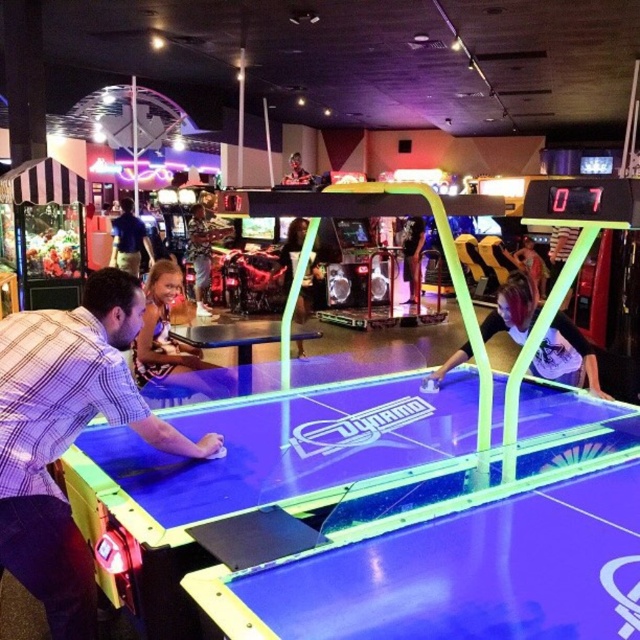
Is shiny silver helmet at center taller than smooth skin face at upper center?

Indeed, shiny silver helmet at center has a greater height compared to smooth skin face at upper center.

Which is in front, point (541, 269) or point (291, 164)?

Point (541, 269) is more forward.

At what (x,y) coordinates should I click in order to perform the action: click on shiny silver helmet at center. Please return your answer as a coordinate pair (x, y). Looking at the image, I should click on (529, 264).

Describe the element at coordinates (566, 356) in the screenshot. I see `matte purple shirt at center` at that location.

Between point (566, 346) and point (188, 228), which one is positioned behind?

The point (188, 228) is behind.

Does point (534, 305) lie in front of point (208, 250)?

Yes, it is in front of point (208, 250).

Where is `matte purple shirt at center`? This screenshot has width=640, height=640. matte purple shirt at center is located at coordinates (566, 356).

Between plaid shirt at left and blue shirt at center, which one has less height?

Standing shorter between the two is plaid shirt at left.

How distant is plaid shirt at left from blue shirt at center?

8.14 meters

Between point (76, 554) and point (141, 232), which one is positioned in front?

Point (76, 554)

Find the location of `plaid shirt at left`. plaid shirt at left is located at coordinates (67, 435).